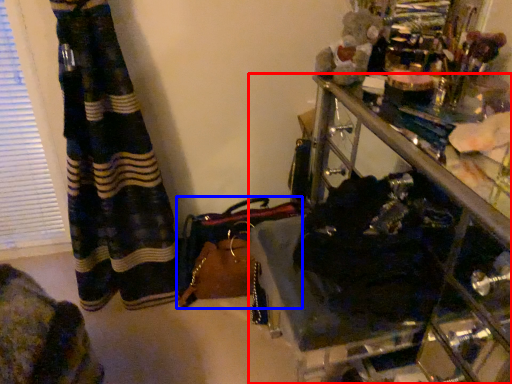
Question: Among these objects, which one is nearest to the camera, furniture (highlighted by a red box) or handbag (highlighted by a blue box)?

Choices:
 (A) furniture
 (B) handbag

Answer: (A)